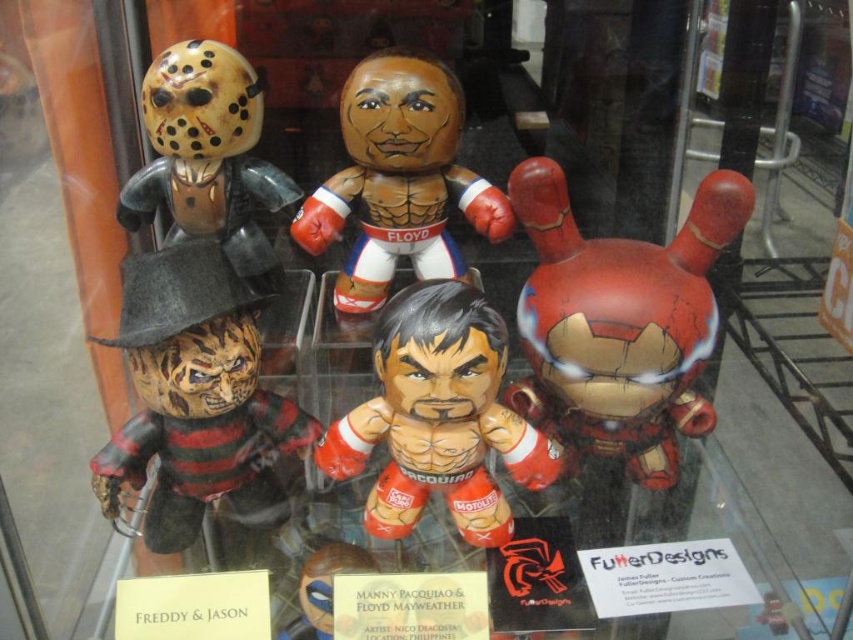
Question: Which of the following is the farthest from the observer?

Choices:
 (A) (509, 180)
 (B) (399, 483)
 (C) (236, 227)

Answer: (C)

Question: Can you confirm if cracked metallic iron man at right is positioned below matte brown figure at center?

Choices:
 (A) yes
 (B) no

Answer: (A)

Question: Does wooden freddy krueger figure at left appear under matte red boxing glove at center?

Choices:
 (A) yes
 (B) no

Answer: (B)

Question: Is matte red boxing glove at center further to the viewer compared to matte brown figure at center?

Choices:
 (A) no
 (B) yes

Answer: (A)

Question: Which of the following is the farthest from the observer?

Choices:
 (A) matte black helmet at upper left
 (B) matte brown figure at center
 (C) matte red boxing glove at center
 (D) cracked metallic iron man at right

Answer: (B)

Question: Which point is closer to the camera?

Choices:
 (A) matte brown figure at center
 (B) matte black helmet at upper left
 (C) matte red boxing glove at center

Answer: (C)